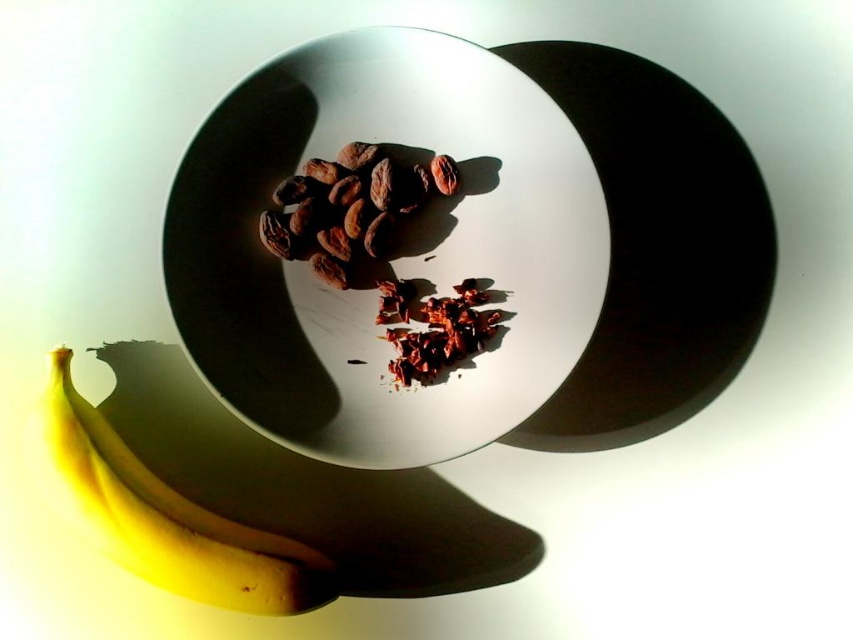
Consider the image. You are a chef preparing a dessert and need to place the dark red crumbly chocolate at center onto the white glossy plate at center. Given that the plate has a diameter of 10 inches, will the chocolate fit on the plate without spilling over?

The white glossy plate at center and dark red crumbly chocolate at center are 5.63 inches apart. Since the plate has a diameter of 10 inches, the chocolate can be placed within the plate as the distance between them allows for positioning it comfortably within the plate.

You are a chef preparing a dessert and need to know the height of the yellow matte bananas at lower left and brown matte chocolate at center. Which one is taller?

The yellow matte bananas at lower left is taller than brown matte chocolate at center.